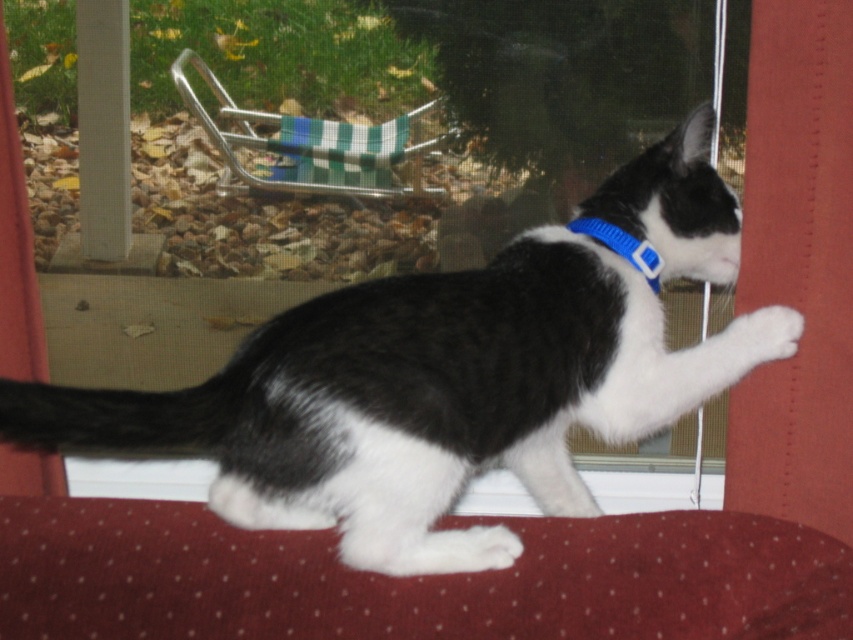
Is green checkered fabric chair at upper center positioned in front of blue fabric neckband at upper center?

That is False.

Does green checkered fabric chair at upper center have a greater width compared to blue fabric neckband at upper center?

Indeed, green checkered fabric chair at upper center has a greater width compared to blue fabric neckband at upper center.

In order to click on green checkered fabric chair at upper center in this screenshot , I will do `click(312, 145)`.

Identify the location of green checkered fabric chair at upper center. (312, 145).

Is black/white fur cat at center positioned in front of blue fabric neckband at upper center?

That is True.

Who is higher up, black/white fur cat at center or blue fabric neckband at upper center?

blue fabric neckband at upper center is higher up.

Who is more distant from viewer, [601,436] or [631,262]?

The point [601,436] is more distant.

The width and height of the screenshot is (853, 640). Find the location of `black/white fur cat at center`. black/white fur cat at center is located at coordinates (419, 400).

Consider the image. Who is taller, black/white fur cat at center or green checkered fabric chair at upper center?

With more height is black/white fur cat at center.

Which is more to the right, black/white fur cat at center or green checkered fabric chair at upper center?

From the viewer's perspective, black/white fur cat at center appears more on the right side.

In order to click on black/white fur cat at center in this screenshot , I will do `click(419, 400)`.

Where is `black/white fur cat at center`? This screenshot has height=640, width=853. black/white fur cat at center is located at coordinates point(419,400).